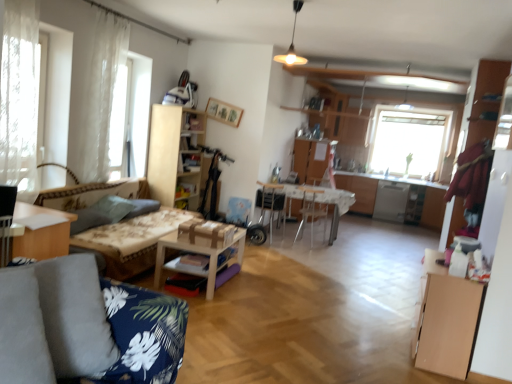
Question: Could you tell me if white glossy table at center, the 3th table viewed from the front, is turned towards light brown wooden table at lower left, the third table from the back?

Choices:
 (A) yes
 (B) no

Answer: (A)

Question: From a real-world perspective, is white glossy table at center, arranged as the first table when viewed from the back, on light brown wooden table at lower left, the 1th table in the front-to-back sequence?

Choices:
 (A) no
 (B) yes

Answer: (A)

Question: Is white glossy table at center, the 3th table viewed from the front, positioned before light brown wooden table at lower left, acting as the first table starting from the left?

Choices:
 (A) no
 (B) yes

Answer: (A)

Question: Is white glossy table at center, arranged as the third table when viewed from the left, to the left of light brown wooden table at lower left, the third table positioned from the right, from the viewer's perspective?

Choices:
 (A) yes
 (B) no

Answer: (B)

Question: Is white glossy table at center, which ranks as the first table in right-to-left order, not inside light brown wooden table at lower left, acting as the first table starting from the left?

Choices:
 (A) no
 (B) yes

Answer: (B)

Question: Is there a large distance between white glossy table at center, the 3th table viewed from the front, and light brown wooden table at lower left, the third table positioned from the right?

Choices:
 (A) no
 (B) yes

Answer: (B)

Question: Considering the relative sizes of white glossy table at center, which ranks as the first table in right-to-left order, and gray fabric pillow at left, the second pillow when ordered from front to back, in the image provided, is white glossy table at center, which ranks as the first table in right-to-left order, smaller than gray fabric pillow at left, the second pillow when ordered from front to back,?

Choices:
 (A) no
 (B) yes

Answer: (A)

Question: Is white glossy table at center, which ranks as the first table in right-to-left order, far away from gray fabric pillow at left, arranged as the 1th pillow when viewed from the back?

Choices:
 (A) no
 (B) yes

Answer: (B)

Question: Does white glossy table at center, which ranks as the first table in right-to-left order, have a lesser height compared to gray fabric pillow at left, arranged as the 1th pillow when viewed from the back?

Choices:
 (A) yes
 (B) no

Answer: (B)

Question: Can you confirm if white glossy table at center, arranged as the third table when viewed from the left, is positioned to the right of gray fabric pillow at left, the second pillow when ordered from front to back?

Choices:
 (A) no
 (B) yes

Answer: (B)

Question: Considering the relative sizes of white glossy table at center, the 3th table viewed from the front, and gray fabric pillow at left, the second pillow when ordered from front to back, in the image provided, is white glossy table at center, the 3th table viewed from the front, wider than gray fabric pillow at left, the second pillow when ordered from front to back,?

Choices:
 (A) yes
 (B) no

Answer: (A)

Question: Could you tell me if white glossy table at center, which ranks as the first table in right-to-left order, is turned towards gray fabric pillow at left, the second pillow when ordered from front to back?

Choices:
 (A) yes
 (B) no

Answer: (B)

Question: Does satin silver dishwasher at right appear on the left side of light wood cabinet at center, the first cabinetry positioned from the left?

Choices:
 (A) yes
 (B) no

Answer: (B)